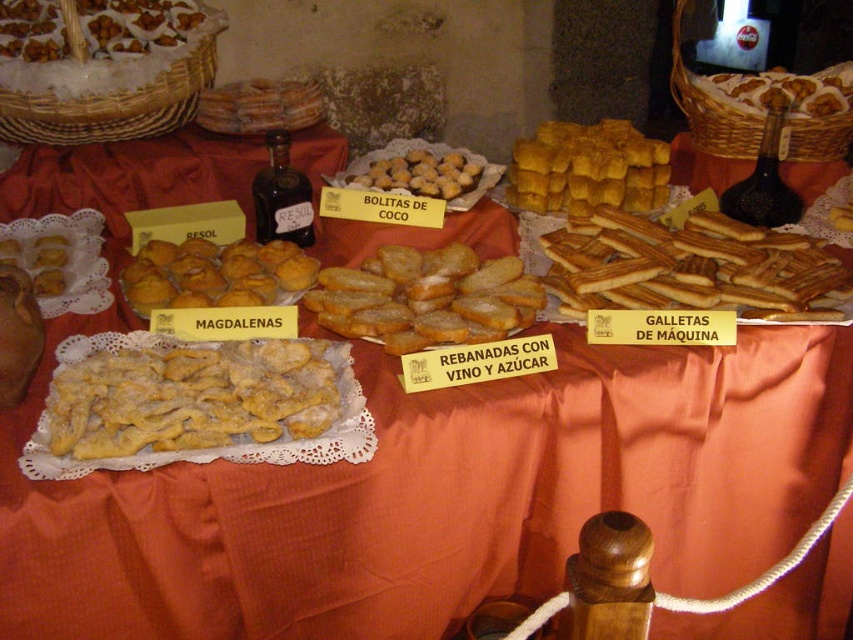
Is golden crisp galletas at center wider than golden crumbly muffins at center?

Correct, the width of golden crisp galletas at center exceeds that of golden crumbly muffins at center.

Does golden crisp galletas at center appear under golden crumbly muffins at center?

Actually, golden crisp galletas at center is above golden crumbly muffins at center.

Does point (544, 276) lie in front of point (183, 300)?

No, (544, 276) is further to viewer.

Find the location of `golden crisp galletas at center`. golden crisp galletas at center is located at coordinates (691, 268).

Between golden fried pastry at center and sugared golden-brown bread slices at center, which one appears on the left side from the viewer's perspective?

golden fried pastry at center is more to the left.

Who is positioned more to the right, golden fried pastry at center or sugared golden-brown bread slices at center?

sugared golden-brown bread slices at center

Which is behind, point (173, 349) or point (418, 337)?

The point (418, 337) is behind.

Identify the location of golden fried pastry at center. The width and height of the screenshot is (853, 640). (190, 397).

Does golden fried pastry at center have a greater width compared to golden crispy pastry at upper right?

In fact, golden fried pastry at center might be narrower than golden crispy pastry at upper right.

Does golden fried pastry at center have a lesser height compared to golden crispy pastry at upper right?

Indeed, golden fried pastry at center has a lesser height compared to golden crispy pastry at upper right.

Image resolution: width=853 pixels, height=640 pixels. Describe the element at coordinates (190, 397) in the screenshot. I see `golden fried pastry at center` at that location.

Where is `golden fried pastry at center`? golden fried pastry at center is located at coordinates (190, 397).